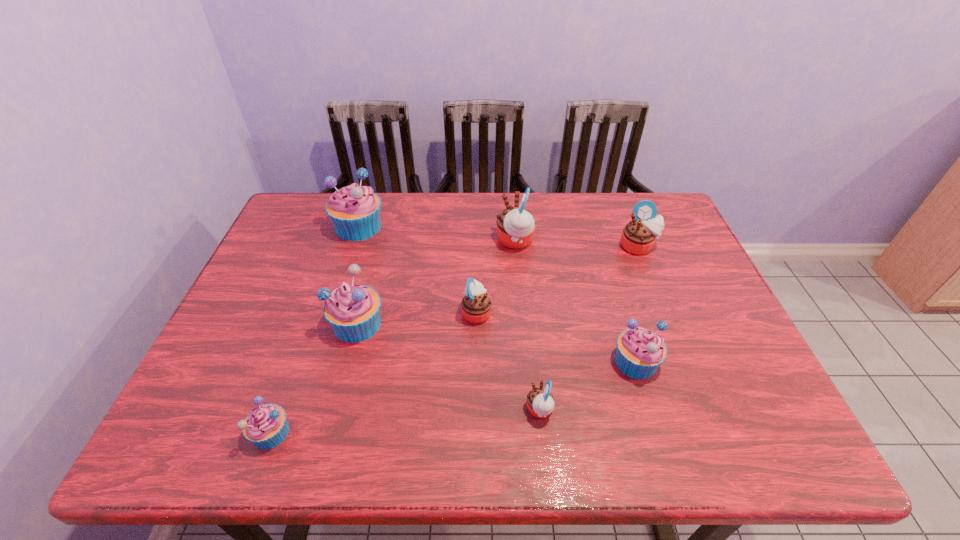
This screenshot has height=540, width=960. What are the coordinates of `blue muffin that is the third closest to the biggest blue muffin` in the screenshot? It's located at coord(640,352).

Where is `blank area in the image that satisfies the following two spatial constraints: 1. on the front-facing side of the second smallest blue muffin; 2. on the left side of the third biggest pink muffin`? The height and width of the screenshot is (540, 960). blank area in the image that satisfies the following two spatial constraints: 1. on the front-facing side of the second smallest blue muffin; 2. on the left side of the third biggest pink muffin is located at coordinates (476, 361).

At what (x,y) coordinates should I click in order to perform the action: click on vacant point that satisfies the following two spatial constraints: 1. on the front-facing side of the smallest pink muffin; 2. on the front side of the smallest blue muffin. Please return your answer as a coordinate pair (x, y). Looking at the image, I should click on (542, 433).